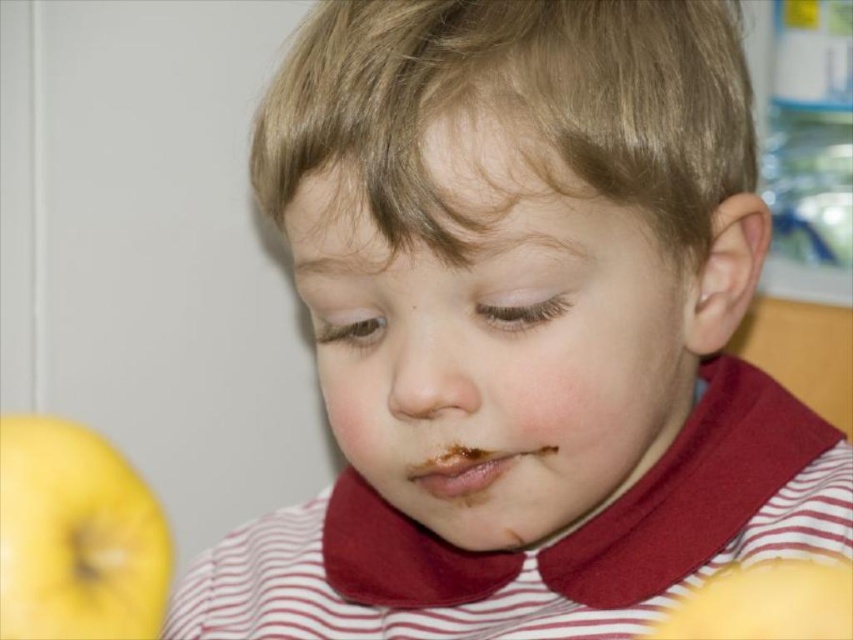
Based on the scene description, can you determine which object is taller between the smooth skin face at center and the yellow matte apple at lower left?

The smooth skin face at center is taller than the yellow matte apple at lower left according to the description.

Looking at this image, you are a photographer adjusting the lighting for a portrait. You notice the smooth skin face at center and the yellow matte apple at lower left. Which object is positioned to the right side of the frame?

The smooth skin face at center is positioned to the right of the yellow matte apple at lower left, so the smooth skin face at center is on the right side of the frame.

You are a photographer adjusting the lighting in the studio. You need to ensure that the yellow matte apple at lower left is visible without being too bright. Since the smooth skin face at center is already well lit, where should you place the light source to highlight the apple without overexposing the face?

The yellow matte apple at lower left is behind the smooth skin face at center. To highlight the apple without overexposing the face, position the light source behind the photographer, shining towards the apple. This way, the face blocks direct light on the apple, creating a subtle illumination while keeping the face properly lit.